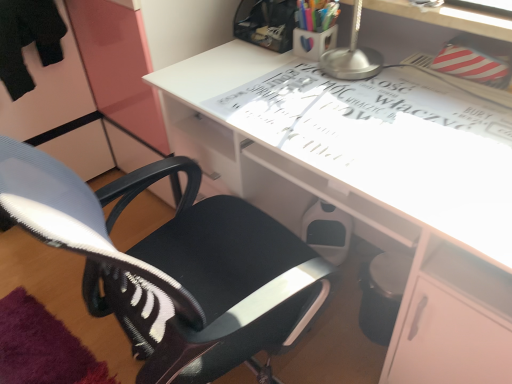
Locate an element on the screen. translucent plastic cup at upper center, acting as the 1th stationery starting from the top is located at coordinates (316, 14).

I want to click on white glossy desk at center, so click(x=389, y=191).

Does matte plastic cup at upper center, the first stationery in the bottom-to-top sequence, have a greater width compared to translucent plastic cup at upper center, marked as the 2th stationery in a bottom-to-top arrangement?

Yes, matte plastic cup at upper center, the first stationery in the bottom-to-top sequence, is wider than translucent plastic cup at upper center, marked as the 2th stationery in a bottom-to-top arrangement.

Is matte plastic cup at upper center, which appears as the 2th stationery when viewed from the top, positioned beyond the bounds of translucent plastic cup at upper center, acting as the 1th stationery starting from the top?

Indeed, matte plastic cup at upper center, which appears as the 2th stationery when viewed from the top, is completely outside translucent plastic cup at upper center, acting as the 1th stationery starting from the top.

Based on the photo, from a real-world perspective, is matte plastic cup at upper center, the first stationery in the bottom-to-top sequence, positioned above or below translucent plastic cup at upper center, acting as the 1th stationery starting from the top?

From a real-world perspective, matte plastic cup at upper center, the first stationery in the bottom-to-top sequence, is physically below translucent plastic cup at upper center, acting as the 1th stationery starting from the top.

The height and width of the screenshot is (384, 512). Find the location of `stationery above the matte plastic cup at upper center, which appears as the 2th stationery when viewed from the top (from the image's perspective)`. stationery above the matte plastic cup at upper center, which appears as the 2th stationery when viewed from the top (from the image's perspective) is located at coordinates (316, 14).

You are a GUI agent. You are given a task and a screenshot of the screen. Output one action in this format:
    pyautogui.click(x=<x>, y=<y>)
    Task: Click on the computer chair in front of the white glossy desk at center
    The image size is (512, 384).
    Given the screenshot: What is the action you would take?
    173,266

Is black fabric chair at center smaller than white glossy desk at center?

Correct, black fabric chair at center occupies less space than white glossy desk at center.

Considering the sizes of objects black fabric chair at center and white glossy desk at center in the image provided, who is thinner, black fabric chair at center or white glossy desk at center?

white glossy desk at center is thinner.

How far apart are black fabric chair at center and white glossy desk at center?

The distance of black fabric chair at center from white glossy desk at center is 12.61 inches.

From the image's perspective, would you say matte plastic cup at upper center, which appears as the 2th stationery when viewed from the top, is shown under black fabric chair at center?

No.

From a real-world perspective, which is physically below, matte plastic cup at upper center, the first stationery in the bottom-to-top sequence, or black fabric chair at center?

In real-world perspective, black fabric chair at center is lower.

Considering the sizes of objects matte plastic cup at upper center, which appears as the 2th stationery when viewed from the top, and black fabric chair at center in the image provided, who is smaller, matte plastic cup at upper center, which appears as the 2th stationery when viewed from the top, or black fabric chair at center?

With smaller size is matte plastic cup at upper center, which appears as the 2th stationery when viewed from the top.

Identify the location of computer chair beneath the matte plastic cup at upper center, the first stationery in the bottom-to-top sequence (from a real-world perspective). (173, 266).

Which is nearer, (315, 10) or (364, 13)?

Point (315, 10) is positioned closer to the camera compared to point (364, 13).

In order to click on stationery that is the 2nd one above the white glossy desk at center (from a real-world perspective) in this screenshot , I will do `click(316, 14)`.

From the image's perspective, between translucent plastic cup at upper center, marked as the 2th stationery in a bottom-to-top arrangement, and white glossy desk at center, who is located below?

white glossy desk at center appears lower in the image.

Is translucent plastic cup at upper center, marked as the 2th stationery in a bottom-to-top arrangement, with white glossy desk at center?

translucent plastic cup at upper center, marked as the 2th stationery in a bottom-to-top arrangement, and white glossy desk at center are not in contact.

From the picture: Is white glossy desk at center outside of black fabric chair at center?

Yes, white glossy desk at center is located beyond the bounds of black fabric chair at center.

Is white glossy desk at center taller than black fabric chair at center?

Incorrect, the height of white glossy desk at center is not larger of that of black fabric chair at center.

From the image's perspective, between white glossy desk at center and black fabric chair at center, who is located below?

black fabric chair at center is shown below in the image.

From a real-world perspective, who is located lower, black fabric chair at center or translucent plastic cup at upper center, acting as the 1th stationery starting from the top?

black fabric chair at center is physically lower.

Considering their positions, is black fabric chair at center located in front of or behind translucent plastic cup at upper center, acting as the 1th stationery starting from the top?

Visually, black fabric chair at center is located in front of translucent plastic cup at upper center, acting as the 1th stationery starting from the top.

Does point (132, 189) appear closer or farther from the camera than point (324, 13)?

Clearly, point (132, 189) is closer to the camera than point (324, 13).

Locate an element on the screen. Image resolution: width=512 pixels, height=384 pixels. stationery that is the 1st object to the right of the black fabric chair at center, starting at the anchor is located at coordinates (316, 14).

Which is further, (416,297) or (334,39)?

The point (334,39) is farther from the camera.

Considering the relative sizes of white glossy desk at center and matte plastic cup at upper center, the first stationery in the bottom-to-top sequence, in the image provided, is white glossy desk at center shorter than matte plastic cup at upper center, the first stationery in the bottom-to-top sequence,?

In fact, white glossy desk at center may be taller than matte plastic cup at upper center, the first stationery in the bottom-to-top sequence.

Is white glossy desk at center in front of or behind matte plastic cup at upper center, the first stationery in the bottom-to-top sequence, in the image?

Clearly, white glossy desk at center is in front of matte plastic cup at upper center, the first stationery in the bottom-to-top sequence.

Is white glossy desk at center to the right of matte plastic cup at upper center, the first stationery in the bottom-to-top sequence, from the viewer's perspective?

Yes, white glossy desk at center is to the right of matte plastic cup at upper center, the first stationery in the bottom-to-top sequence.

This screenshot has width=512, height=384. I want to click on stationery on the right of translucent plastic cup at upper center, marked as the 2th stationery in a bottom-to-top arrangement, so click(313, 42).

Find the location of `computer chair above the white glossy desk at center (from a real-world perspective)`. computer chair above the white glossy desk at center (from a real-world perspective) is located at coordinates (173, 266).

Based on their spatial positions, is black fabric chair at center or white glossy desk at center further from matte plastic cup at upper center, the first stationery in the bottom-to-top sequence?

black fabric chair at center lies further to matte plastic cup at upper center, the first stationery in the bottom-to-top sequence, than the other object.

When comparing their distances from black fabric chair at center, does matte plastic cup at upper center, the first stationery in the bottom-to-top sequence, or white glossy desk at center seem further?

matte plastic cup at upper center, the first stationery in the bottom-to-top sequence, is further to black fabric chair at center.

From the image, which object appears to be farther from white glossy desk at center, translucent plastic cup at upper center, marked as the 2th stationery in a bottom-to-top arrangement, or matte plastic cup at upper center, which appears as the 2th stationery when viewed from the top?

Among the two, translucent plastic cup at upper center, marked as the 2th stationery in a bottom-to-top arrangement, is located further to white glossy desk at center.

Based on their spatial positions, is translucent plastic cup at upper center, acting as the 1th stationery starting from the top, or black fabric chair at center further from matte plastic cup at upper center, the first stationery in the bottom-to-top sequence?

black fabric chair at center is positioned further to the anchor matte plastic cup at upper center, the first stationery in the bottom-to-top sequence.

Looking at the image, which one is located further to white glossy desk at center, matte plastic cup at upper center, which appears as the 2th stationery when viewed from the top, or black fabric chair at center?

matte plastic cup at upper center, which appears as the 2th stationery when viewed from the top, lies further to white glossy desk at center than the other object.

Considering their positions, is white glossy desk at center positioned further to matte plastic cup at upper center, the first stationery in the bottom-to-top sequence, than translucent plastic cup at upper center, marked as the 2th stationery in a bottom-to-top arrangement?

white glossy desk at center is positioned further to the anchor matte plastic cup at upper center, the first stationery in the bottom-to-top sequence.

Which object lies further to the anchor point translucent plastic cup at upper center, marked as the 2th stationery in a bottom-to-top arrangement, white glossy desk at center or black fabric chair at center?

Among the two, black fabric chair at center is located further to translucent plastic cup at upper center, marked as the 2th stationery in a bottom-to-top arrangement.

Looking at the image, which one is located further to translucent plastic cup at upper center, marked as the 2th stationery in a bottom-to-top arrangement, matte plastic cup at upper center, the first stationery in the bottom-to-top sequence, or white glossy desk at center?

Among the two, white glossy desk at center is located further to translucent plastic cup at upper center, marked as the 2th stationery in a bottom-to-top arrangement.

You are a GUI agent. You are given a task and a screenshot of the screen. Output one action in this format:
    pyautogui.click(x=<x>, y=<y>)
    Task: Click on the stationery between black fabric chair at center and matte plastic cup at upper center, which appears as the 2th stationery when viewed from the top, in the front-back direction
    The height and width of the screenshot is (384, 512).
    Given the screenshot: What is the action you would take?
    pyautogui.click(x=316, y=14)

This screenshot has height=384, width=512. Identify the location of desk between black fabric chair at center and matte plastic cup at upper center, which appears as the 2th stationery when viewed from the top, from front to back. coord(389,191).

This screenshot has width=512, height=384. In order to click on stationery positioned between white glossy desk at center and matte plastic cup at upper center, the first stationery in the bottom-to-top sequence, from near to far in this screenshot , I will do `click(316, 14)`.

Locate an element on the screen. This screenshot has height=384, width=512. desk between translucent plastic cup at upper center, acting as the 1th stationery starting from the top, and black fabric chair at center vertically is located at coordinates (389, 191).